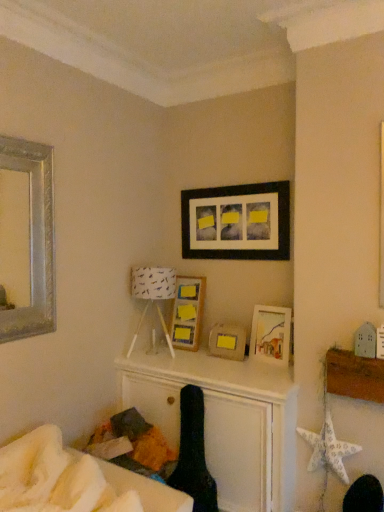
Where is `white soft bed at lower left`? This screenshot has height=512, width=384. white soft bed at lower left is located at coordinates (72, 480).

Describe the element at coordinates (193, 453) in the screenshot. This screenshot has height=512, width=384. I see `black fabric swivel chair at center` at that location.

The image size is (384, 512). What are the coordinates of `black fabric swivel chair at center` in the screenshot? It's located at (193, 453).

Describe the element at coordinates (227, 341) in the screenshot. I see `matte wooden picture frame at center, which is the third picture frame in right-to-left order` at that location.

Locate an element on the screen. The width and height of the screenshot is (384, 512). matte black picture frame at upper center, positioned as the 2th picture frame in right-to-left order is located at coordinates (237, 222).

Where is `white soft bed at lower left`? white soft bed at lower left is located at coordinates (72, 480).

Which is less distant, [3,499] or [167,295]?

Clearly, point [3,499] is closer to the camera than point [167,295].

From a real-world perspective, between white soft bed at lower left and white fabric lampshade at center, who is vertically lower?

white soft bed at lower left is physically lower.

From the image's perspective, would you say white soft bed at lower left is shown under white fabric lampshade at center?

Yes, from the image's perspective, white soft bed at lower left is below white fabric lampshade at center.

Based on the photo, considering the relative sizes of white soft bed at lower left and white fabric lampshade at center in the image provided, is white soft bed at lower left wider than white fabric lampshade at center?

No, white soft bed at lower left is not wider than white fabric lampshade at center.

Is silver metallic mirror at upper left, which is counted as the first picture frame, starting from the left, inside white fabric lampshade at center?

That's incorrect, silver metallic mirror at upper left, which is counted as the first picture frame, starting from the left, is not inside white fabric lampshade at center.

Does white fabric lampshade at center turn towards silver metallic mirror at upper left, the 5th picture frame when ordered from right to left?

Yes, white fabric lampshade at center is turned towards silver metallic mirror at upper left, the 5th picture frame when ordered from right to left.

Measure the distance between white fabric lampshade at center and silver metallic mirror at upper left, the 5th picture frame when ordered from right to left.

white fabric lampshade at center and silver metallic mirror at upper left, the 5th picture frame when ordered from right to left, are 30.02 inches apart.

From a real-world perspective, is white fabric lampshade at center positioned over silver metallic mirror at upper left, which is counted as the first picture frame, starting from the left, based on gravity?

Incorrect, from a real-world perspective, white fabric lampshade at center is lower than silver metallic mirror at upper left, which is counted as the first picture frame, starting from the left.

Between matte wooden picture frame at center-right, which is the fifth picture frame from left to right, and white fabric lampshade at center, which one has smaller size?

Smaller between the two is matte wooden picture frame at center-right, which is the fifth picture frame from left to right.

From the image's perspective, is matte wooden picture frame at center-right, which is the 1th picture frame from right to left, above white fabric lampshade at center?

No, from the image's perspective, matte wooden picture frame at center-right, which is the 1th picture frame from right to left, is not over white fabric lampshade at center.

Considering the sizes of objects matte wooden picture frame at center-right, which is the fifth picture frame from left to right, and white fabric lampshade at center in the image provided, who is taller, matte wooden picture frame at center-right, which is the fifth picture frame from left to right, or white fabric lampshade at center?

white fabric lampshade at center.

Is matte wooden picture frame at center-right, which is the 1th picture frame from right to left, positioned beyond the bounds of white fabric lampshade at center?

Yes.

Does matte wooden picture frame at center-right, which is the fifth picture frame from left to right, have a greater width compared to wooden frame with sticky notes at upper center, which is counted as the 2th picture frame, starting from the left?

In fact, matte wooden picture frame at center-right, which is the fifth picture frame from left to right, might be narrower than wooden frame with sticky notes at upper center, which is counted as the 2th picture frame, starting from the left.

Which object is positioned more to the right, matte wooden picture frame at center-right, which is the 1th picture frame from right to left, or wooden frame with sticky notes at upper center, which is counted as the 2th picture frame, starting from the left?

From the viewer's perspective, matte wooden picture frame at center-right, which is the 1th picture frame from right to left, appears more on the right side.

Is matte wooden picture frame at center-right, which is the 1th picture frame from right to left, positioned far away from wooden frame with sticky notes at upper center, which is counted as the 2th picture frame, starting from the left?

No, matte wooden picture frame at center-right, which is the 1th picture frame from right to left, is not far from wooden frame with sticky notes at upper center, which is counted as the 2th picture frame, starting from the left.

From the image's perspective, which one is positioned lower, matte wooden picture frame at center-right, which is the 1th picture frame from right to left, or wooden frame with sticky notes at upper center, arranged as the fourth picture frame when viewed from the right?

matte wooden picture frame at center-right, which is the 1th picture frame from right to left.

Is the surface of matte wooden picture frame at center-right, which is the 1th picture frame from right to left, in direct contact with silver metallic mirror at upper left, which is counted as the first picture frame, starting from the left?

matte wooden picture frame at center-right, which is the 1th picture frame from right to left, and silver metallic mirror at upper left, which is counted as the first picture frame, starting from the left, are not in contact.

Which is more to the left, matte wooden picture frame at center-right, which is the 1th picture frame from right to left, or silver metallic mirror at upper left, which is counted as the first picture frame, starting from the left?

silver metallic mirror at upper left, which is counted as the first picture frame, starting from the left.

Does matte wooden picture frame at center-right, which is the fifth picture frame from left to right, have a smaller size compared to silver metallic mirror at upper left, which is counted as the first picture frame, starting from the left?

Yes.

Measure the distance between matte wooden picture frame at center-right, which is the fifth picture frame from left to right, and silver metallic mirror at upper left, which is counted as the first picture frame, starting from the left.

4.53 feet.

Is silver metallic mirror at upper left, which is counted as the first picture frame, starting from the left, far away from black fabric swivel chair at center?

Yes, silver metallic mirror at upper left, which is counted as the first picture frame, starting from the left, and black fabric swivel chair at center are quite far apart.

Consider the image. Is silver metallic mirror at upper left, which is counted as the first picture frame, starting from the left, in front of or behind black fabric swivel chair at center in the image?

silver metallic mirror at upper left, which is counted as the first picture frame, starting from the left, is in front of black fabric swivel chair at center.

Considering the sizes of objects silver metallic mirror at upper left, the 5th picture frame when ordered from right to left, and black fabric swivel chair at center in the image provided, who is shorter, silver metallic mirror at upper left, the 5th picture frame when ordered from right to left, or black fabric swivel chair at center?

With less height is black fabric swivel chair at center.

What's the angular difference between white paper star at lower right and white soft bed at lower left's facing directions?

The facing directions of white paper star at lower right and white soft bed at lower left are 85.3 degrees apart.

Considering the relative positions of white paper star at lower right and white soft bed at lower left in the image provided, is white paper star at lower right behind white soft bed at lower left?

Yes, white paper star at lower right is further from the camera.

Is white paper star at lower right directly adjacent to white soft bed at lower left?

No, white paper star at lower right is not beside white soft bed at lower left.

Is white paper star at lower right wider than white soft bed at lower left?

In fact, white paper star at lower right might be narrower than white soft bed at lower left.

The height and width of the screenshot is (512, 384). I want to click on furniture in front of the white fabric lampshade at center, so click(72, 480).

Identify the location of table lamp that appears below the silver metallic mirror at upper left, which is counted as the first picture frame, starting from the left (from the image's perspective). The width and height of the screenshot is (384, 512). (153, 295).

Estimate the real-world distances between objects in this image. Which object is further from wooden frame with sticky notes at upper center, which is counted as the 2th picture frame, starting from the left, white soft bed at lower left or silver metallic mirror at upper left, which is counted as the first picture frame, starting from the left?

white soft bed at lower left is further to wooden frame with sticky notes at upper center, which is counted as the 2th picture frame, starting from the left.

Based on their spatial positions, is black fabric swivel chair at center or silver metallic mirror at upper left, which is counted as the first picture frame, starting from the left, closer to white fabric lampshade at center?

black fabric swivel chair at center lies closer to white fabric lampshade at center than the other object.

Estimate the real-world distances between objects in this image. Which object is closer to white paper star at lower right, matte wooden picture frame at center-right, which is the 1th picture frame from right to left, or matte black picture frame at upper center, positioned as the 2th picture frame in right-to-left order?

matte wooden picture frame at center-right, which is the 1th picture frame from right to left, is closer to white paper star at lower right.

Considering their positions, is white soft bed at lower left positioned closer to matte wooden picture frame at center, which ranks as the third picture frame in left-to-right order, than matte wooden picture frame at center-right, which is the 1th picture frame from right to left?

matte wooden picture frame at center-right, which is the 1th picture frame from right to left, is closer to matte wooden picture frame at center, which ranks as the third picture frame in left-to-right order.

Which object lies further to the anchor point black fabric swivel chair at center, matte wooden picture frame at center-right, which is the 1th picture frame from right to left, or white soft bed at lower left?

Based on the image, matte wooden picture frame at center-right, which is the 1th picture frame from right to left, appears to be further to black fabric swivel chair at center.

When comparing their distances from matte wooden picture frame at center, which is the third picture frame in right-to-left order, does white paper star at lower right or white fabric lampshade at center seem further?

The object further to matte wooden picture frame at center, which is the third picture frame in right-to-left order, is white paper star at lower right.

From the image, which object appears to be farther from white soft bed at lower left, silver metallic mirror at upper left, the 5th picture frame when ordered from right to left, or matte black picture frame at upper center, positioned as the 2th picture frame in right-to-left order?

Based on the image, matte black picture frame at upper center, positioned as the 2th picture frame in right-to-left order, appears to be further to white soft bed at lower left.

Considering their positions, is black fabric swivel chair at center positioned closer to matte wooden picture frame at center-right, which is the 1th picture frame from right to left, than silver metallic mirror at upper left, which is counted as the first picture frame, starting from the left?

The object closer to matte wooden picture frame at center-right, which is the 1th picture frame from right to left, is black fabric swivel chair at center.

At what (x,y) coordinates should I click in order to perform the action: click on starfish between matte black picture frame at upper center, positioned as the 2th picture frame in right-to-left order, and white soft bed at lower left from top to bottom. Please return your answer as a coordinate pair (x, y). Looking at the image, I should click on (328, 449).

Where is `furniture between silver metallic mirror at upper left, the 5th picture frame when ordered from right to left, and matte wooden picture frame at center-right, which is the fifth picture frame from left to right`? furniture between silver metallic mirror at upper left, the 5th picture frame when ordered from right to left, and matte wooden picture frame at center-right, which is the fifth picture frame from left to right is located at coordinates (72, 480).

Where is `table lamp between matte black picture frame at upper center, positioned as the 2th picture frame in right-to-left order, and matte wooden picture frame at center, which is the third picture frame in right-to-left order, in the vertical direction`? table lamp between matte black picture frame at upper center, positioned as the 2th picture frame in right-to-left order, and matte wooden picture frame at center, which is the third picture frame in right-to-left order, in the vertical direction is located at coordinates (153, 295).

I want to click on table lamp positioned between white soft bed at lower left and matte black picture frame at upper center, arranged as the 4th picture frame when viewed from the left, from near to far, so click(x=153, y=295).